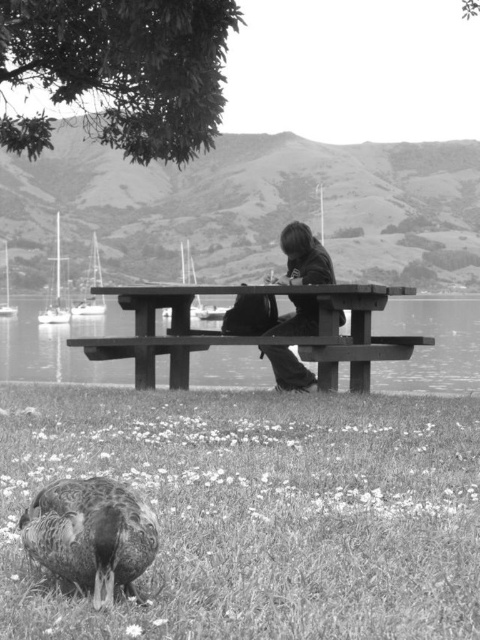
Describe the element at coordinates (254, 337) in the screenshot. I see `wooden picnic table at center` at that location.

Is wooden picnic table at center wider than dark brown leather jacket at center?

Correct, the width of wooden picnic table at center exceeds that of dark brown leather jacket at center.

Is point (335, 332) positioned in front of point (274, 308)?

Yes, it is in front of point (274, 308).

This screenshot has width=480, height=640. Identify the location of wooden picnic table at center. (254, 337).

Is dark brown textured duck at lower left further to camera compared to dark brown leather jacket at center?

No, dark brown textured duck at lower left is in front of dark brown leather jacket at center.

Does dark brown textured duck at lower left appear on the left side of dark brown leather jacket at center?

Indeed, dark brown textured duck at lower left is positioned on the left side of dark brown leather jacket at center.

Is point (37, 557) farther from camera compared to point (288, 324)?

No, (37, 557) is closer to viewer.

Where is `dark brown textured duck at lower left`? The image size is (480, 640). dark brown textured duck at lower left is located at coordinates (91, 534).

Does wooden picnic table at center appear under dark brown textured duck at lower left?

Incorrect, wooden picnic table at center is not positioned below dark brown textured duck at lower left.

Which is above, wooden picnic table at center or dark brown textured duck at lower left?

wooden picnic table at center is above.

Between point (154, 301) and point (120, 516), which one is positioned in front?

Point (120, 516) is in front.

This screenshot has height=640, width=480. I want to click on wooden picnic table at center, so click(x=254, y=337).